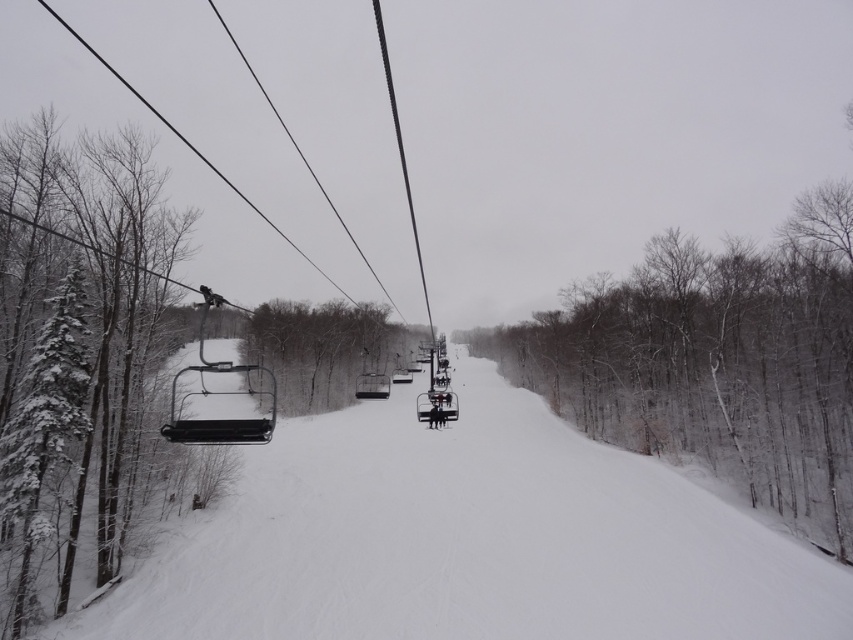
You are a skier planning to take a photo of the ski lift chairs. You have two points marked on your map as potential vantage points. The first is at point (527, 385) and the second at point (50, 346). Based on the scene description, which point would allow you to see the ski lift chairs more clearly?

Point (50, 346) would allow you to see the ski lift chairs more clearly because point (527, 385) is behind it, potentially blocking the view.